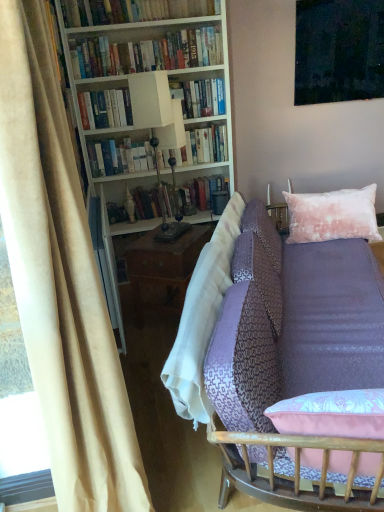
Question: Would you consider white matte bookcase at upper left to be distant from hardcover books at upper center, the second book from the top?

Choices:
 (A) yes
 (B) no

Answer: (B)

Question: From a real-world perspective, is white matte bookcase at upper left under hardcover books at upper center, the 3th book when ordered from bottom to top?

Choices:
 (A) no
 (B) yes

Answer: (B)

Question: From a real-world perspective, is white matte bookcase at upper left on top of hardcover books at upper center, the second book from the top?

Choices:
 (A) no
 (B) yes

Answer: (A)

Question: Is hardcover books at upper center, the 3th book when ordered from bottom to top, inside white matte bookcase at upper left?

Choices:
 (A) no
 (B) yes

Answer: (B)

Question: Can you confirm if white matte bookcase at upper left is bigger than hardcover books at upper center, the second book from the top?

Choices:
 (A) no
 (B) yes

Answer: (B)

Question: From the image's perspective, relative to lavender fabric couch at center, is velvet pink pillow at upper right above or below?

Choices:
 (A) below
 (B) above

Answer: (B)

Question: Is velvet pink pillow at upper right in front of or behind lavender fabric couch at center in the image?

Choices:
 (A) behind
 (B) front

Answer: (A)

Question: Is velvet pink pillow at upper right inside or outside of lavender fabric couch at center?

Choices:
 (A) inside
 (B) outside

Answer: (A)

Question: Visually, is velvet pink pillow at upper right positioned to the left or to the right of lavender fabric couch at center?

Choices:
 (A) left
 (B) right

Answer: (B)

Question: From the image's perspective, is white matte bookcase at upper left positioned above or below metallic polished lamp at center?

Choices:
 (A) below
 (B) above

Answer: (B)

Question: Visually, is white matte bookcase at upper left positioned to the left or to the right of metallic polished lamp at center?

Choices:
 (A) right
 (B) left

Answer: (B)

Question: Does point (76, 95) appear closer or farther from the camera than point (162, 224)?

Choices:
 (A) closer
 (B) farther

Answer: (A)

Question: From a real-world perspective, relative to metallic polished lamp at center, is white matte bookcase at upper left vertically above or below?

Choices:
 (A) above
 (B) below

Answer: (A)

Question: From their relative heights in the image, would you say hardcover books at upper left, which ranks as the 4th book in bottom-to-top order, is taller or shorter than metallic polished lamp at center?

Choices:
 (A) short
 (B) tall

Answer: (A)

Question: Would you say hardcover books at upper left, which is the 1th book in top-to-bottom order, is inside or outside metallic polished lamp at center?

Choices:
 (A) outside
 (B) inside

Answer: (A)